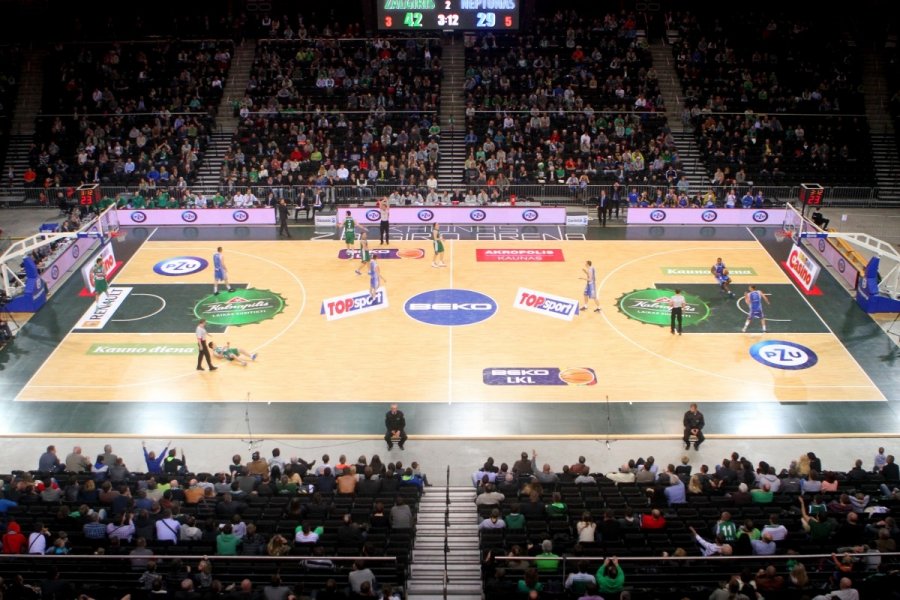
Where is `stairs`? The image size is (900, 600). stairs is located at coordinates (457, 518), (436, 559), (446, 129), (226, 124), (675, 97), (31, 104), (880, 147).